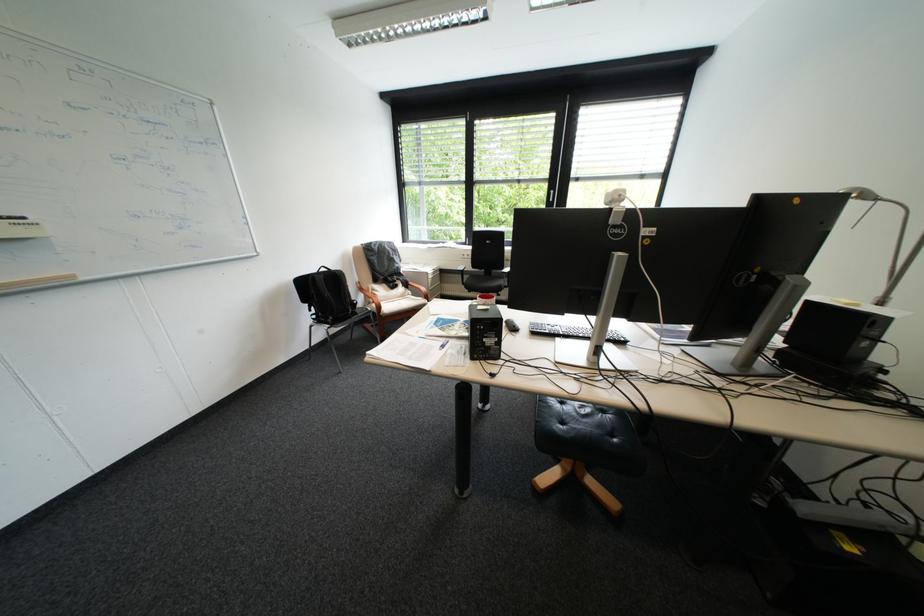
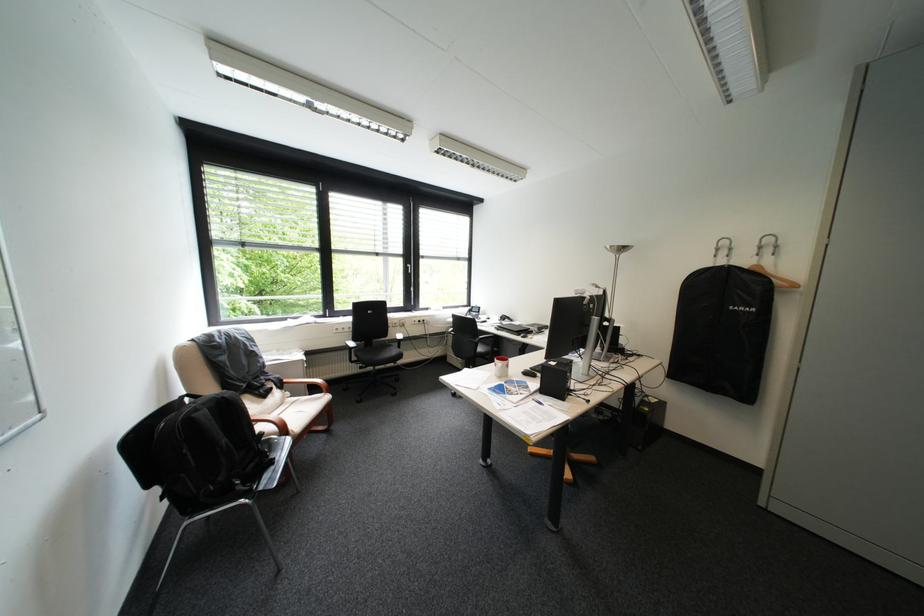
Where in the second image is the point corresponding to (399,292) from the first image?

(272, 403)